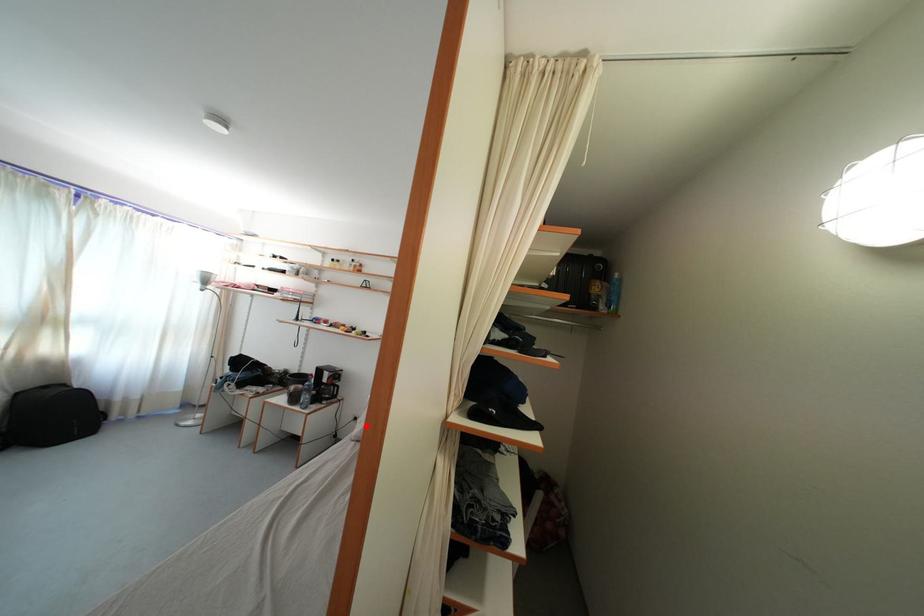
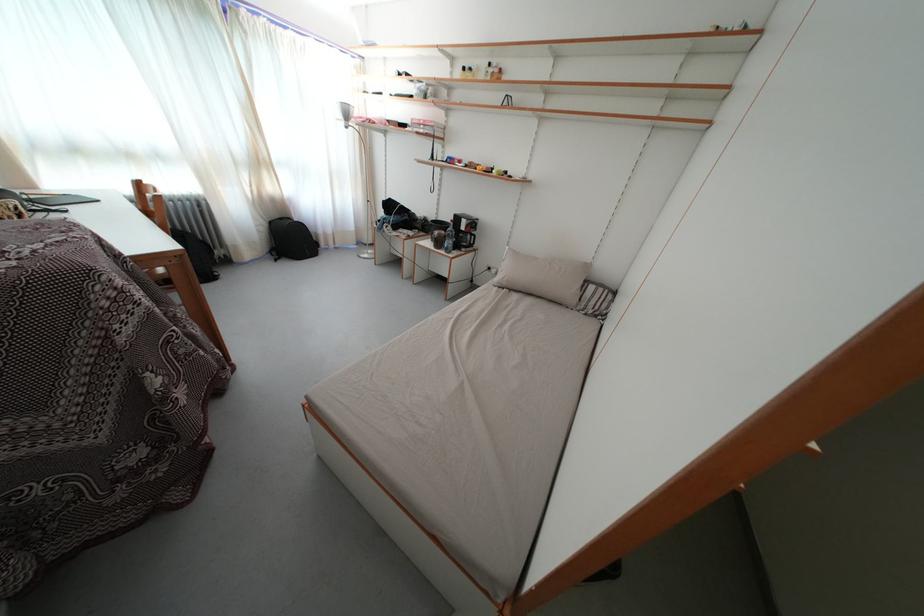
Locate, in the second image, the point that corresponds to the highlighted location in the first image.

(500, 276)